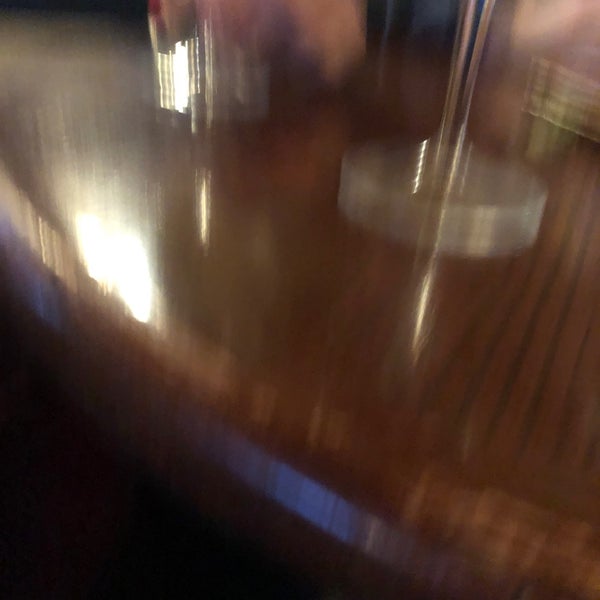
At what (x,y) coordinates should I click in order to perform the action: click on cup. Please return your answer as a coordinate pair (x, y). This screenshot has height=600, width=600. Looking at the image, I should click on (232, 70).